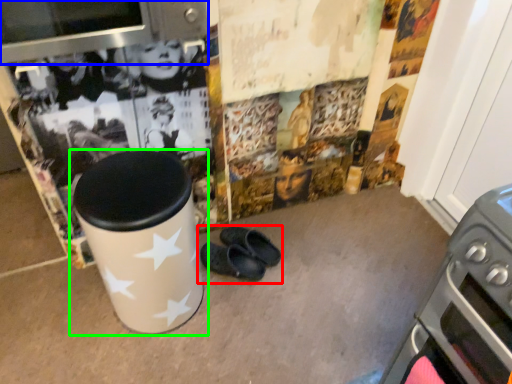
Question: Based on their relative distances, which object is farther from footwear (highlighted by a red box)? Choose from appliance (highlighted by a blue box) and waste container (highlighted by a green box).

Choices:
 (A) appliance
 (B) waste container

Answer: (A)